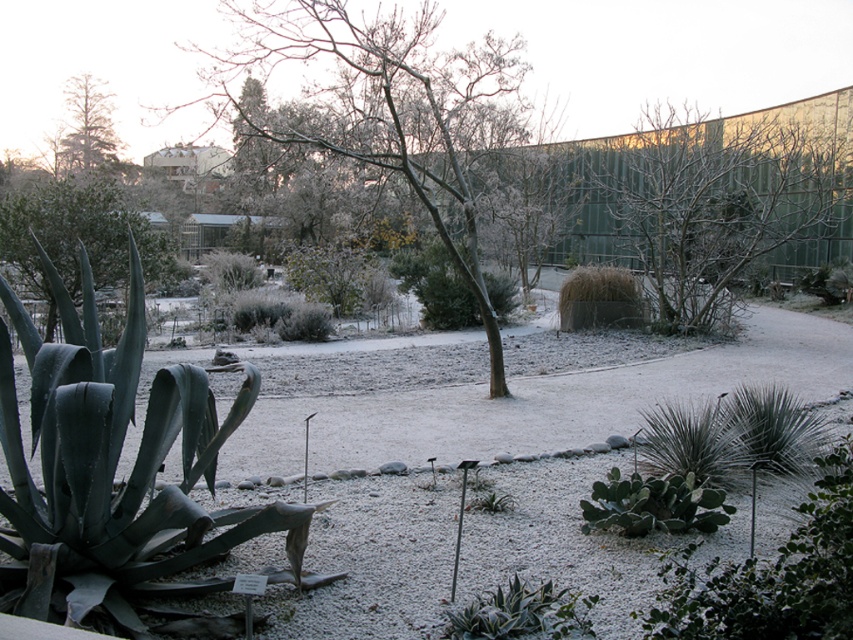
Does frosted bark tree at center have a greater width compared to green matte tree at upper left?

Indeed, frosted bark tree at center has a greater width compared to green matte tree at upper left.

Between frosted bark tree at center and green matte tree at upper left, which one is positioned lower?

Positioned lower is frosted bark tree at center.

This screenshot has height=640, width=853. In order to click on frosted bark tree at center in this screenshot , I will do `click(386, 109)`.

The width and height of the screenshot is (853, 640). Describe the element at coordinates (386, 109) in the screenshot. I see `frosted bark tree at center` at that location.

Measure the distance between frosted bark tree at center and camera.

frosted bark tree at center is 24.35 feet away from camera.

Identify the location of frosted bark tree at center. (386, 109).

Between bare branches at center and green matte tree at upper left, which one is positioned lower?

bare branches at center is below.

Which of these two, bare branches at center or green matte tree at upper left, stands shorter?

Standing shorter between the two is green matte tree at upper left.

The image size is (853, 640). Identify the location of bare branches at center. (722, 195).

Where is `bare branches at center`? bare branches at center is located at coordinates (722, 195).